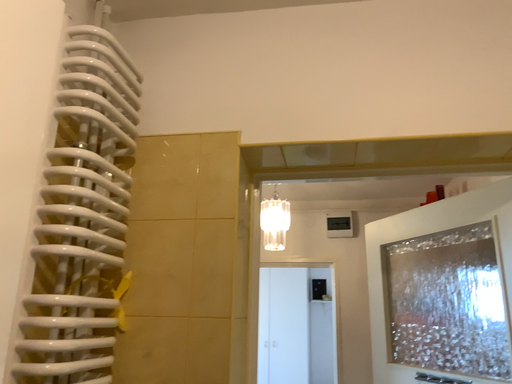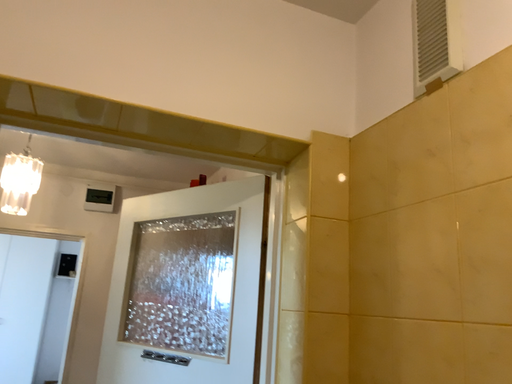
Question: How did the camera likely rotate when shooting the video?

Choices:
 (A) rotated right
 (B) rotated left

Answer: (A)